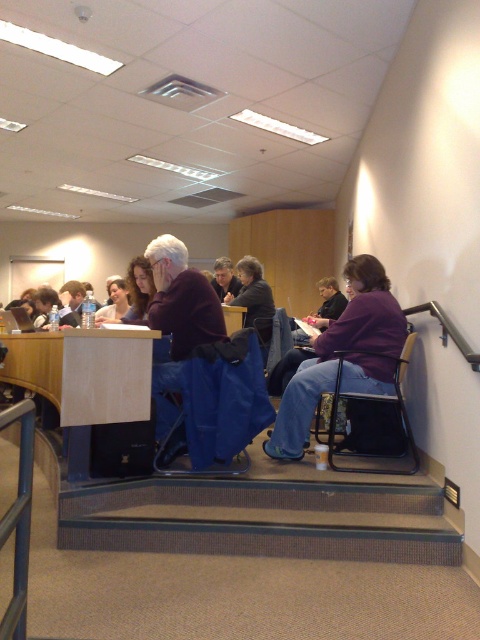
You are a visitor entering the classroom and want to sit down. There is a metallic black chair at lower right and a wooden table at center. Which object should you approach first to sit?

You should approach the metallic black chair at lower right first because it is located below the wooden table at center, indicating it is positioned closer to the entrance where visitors typically enter.

You are sitting in a classroom and want to place your laptop on the desk. If you are sitting on the blue fabric chair at center, where should you place your laptop to ensure it is on the wooden table at center?

Since the blue fabric chair at center is in front of the wooden table at center, you should place your laptop on the surface of the wooden table at center directly behind the chair.